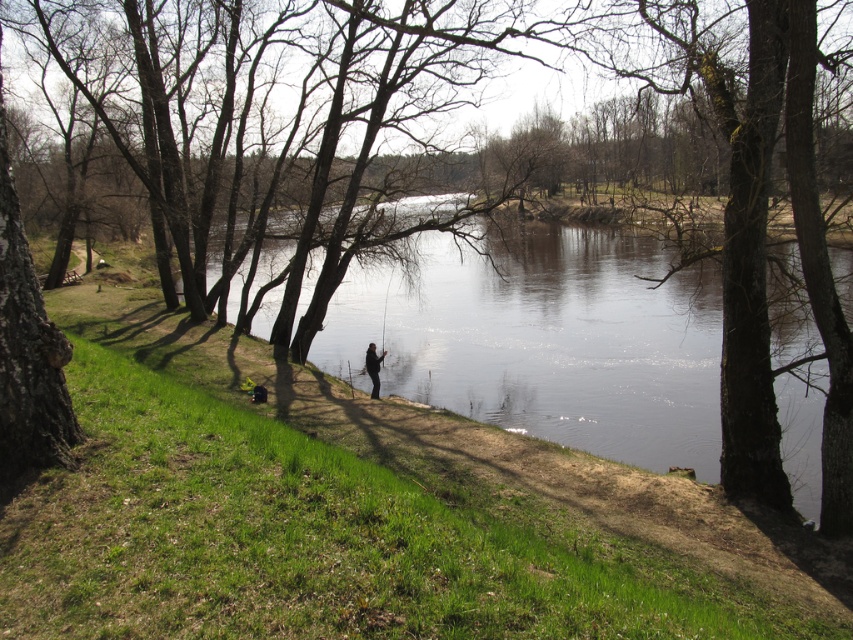
You are standing on the riverside bank and want to place your dark gray jacket on the ground near the clear water. Based on the scene, can you tell if the clear water at center has enough space to accommodate the dark gray jacket at center?

The clear water at center is bigger than the dark gray jacket at center, so there is enough space to place the dark gray jacket at center near the clear water.

You are standing at the point marked as point (546, 340). What do you see directly in front of you?

You see clear water at center directly in front of you at point (546, 340).

You are standing on the riverside and see the clear water at center and the dark gray jacket at center. Which object is positioned to the right side from your perspective?

The clear water at center is to the right of dark gray jacket at center, so the clear water at center is positioned to the right side from your perspective.